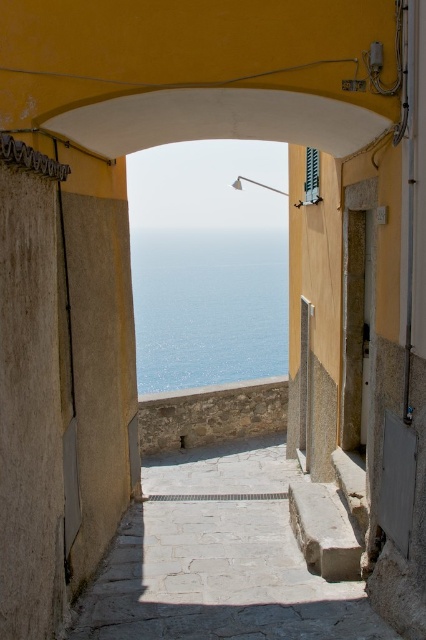
Is stone steps at center shorter than blue water at center?

Yes, stone steps at center is shorter than blue water at center.

In order to click on stone steps at center in this screenshot , I will do `click(218, 560)`.